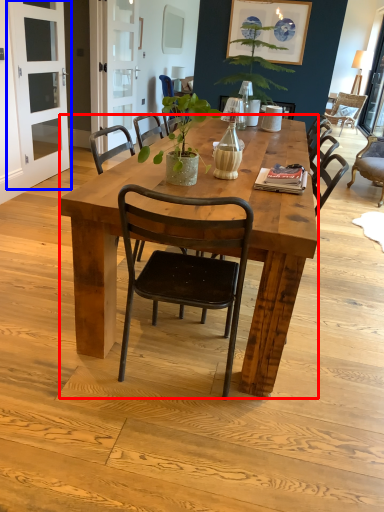
Question: Among these objects, which one is farthest to the camera, desk (highlighted by a red box) or screen door (highlighted by a blue box)?

Choices:
 (A) desk
 (B) screen door

Answer: (B)